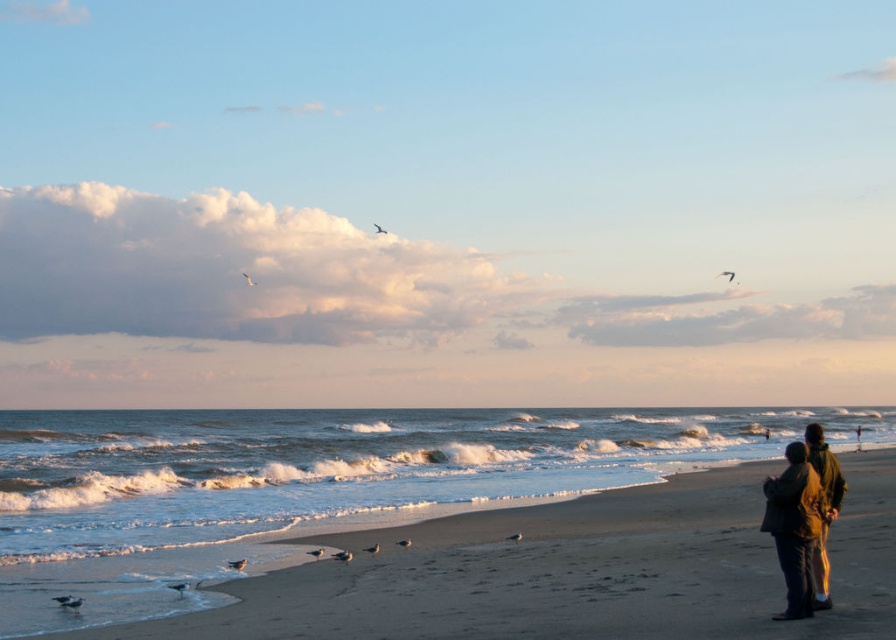
Where is `sandy beach at lower right`? This screenshot has height=640, width=896. sandy beach at lower right is located at coordinates (569, 572).

Is point (866, 465) farther from camera compared to point (806, 492)?

Yes, it is.

I want to click on sandy beach at lower right, so click(569, 572).

Between sandy beach at lower right and green woolen jacket at lower right, which one has more height?

Standing taller between the two is sandy beach at lower right.

Looking at this image, does sandy beach at lower right have a smaller size compared to green woolen jacket at lower right?

No.

Image resolution: width=896 pixels, height=640 pixels. I want to click on sandy beach at lower right, so tap(569, 572).

The image size is (896, 640). Describe the element at coordinates (803, 518) in the screenshot. I see `green fabric jacket at lower right` at that location.

At what (x,y) coordinates should I click in order to perform the action: click on green fabric jacket at lower right. Please return your answer as a coordinate pair (x, y). Looking at the image, I should click on (803, 518).

Which is behind, point (817, 584) or point (823, 561)?

Point (823, 561)

Identify the location of green fabric jacket at lower right. This screenshot has height=640, width=896. (803, 518).